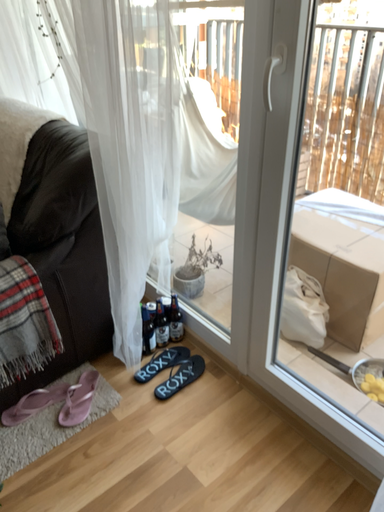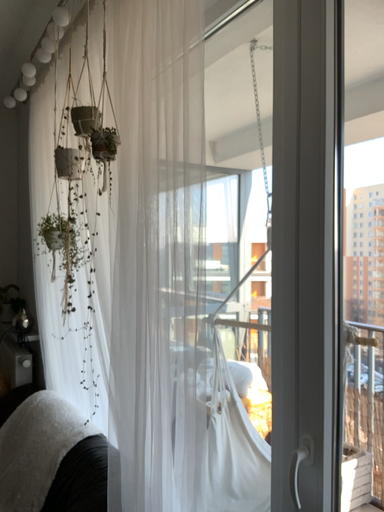
Question: How did the camera likely rotate when shooting the video?

Choices:
 (A) rotated left
 (B) rotated right

Answer: (A)